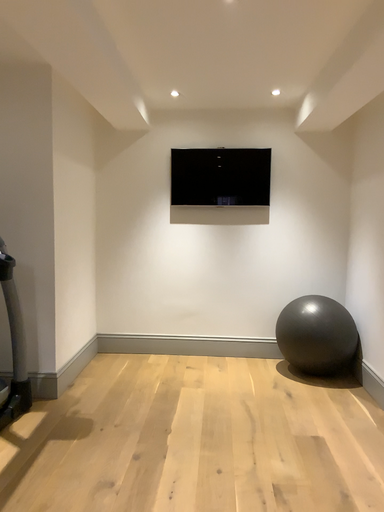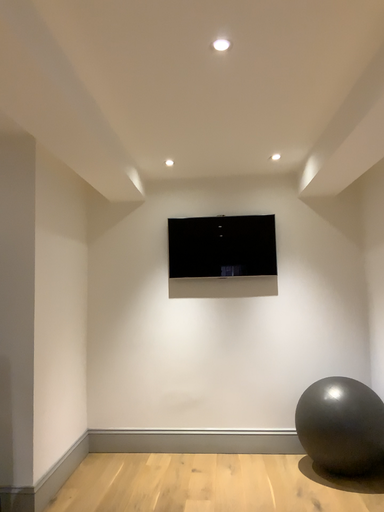
Question: How did the camera likely rotate when shooting the video?

Choices:
 (A) rotated upward
 (B) rotated downward

Answer: (A)